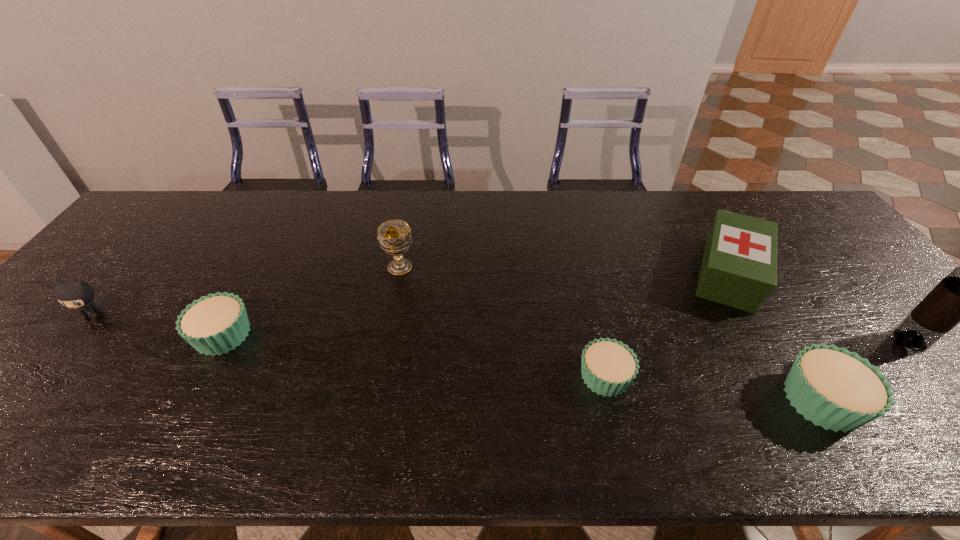
The image size is (960, 540). Find the location of `empty space that is in between the kitten and the tallest object`. empty space that is in between the kitten and the tallest object is located at coordinates (501, 327).

I want to click on unoccupied area between the chalice and the second object from left to right, so click(x=311, y=301).

What are the coordinates of `empty space between the shortest cupcake and the chalice` in the screenshot? It's located at (502, 322).

The image size is (960, 540). Find the location of `free spot between the shortest cupcake and the sixth shortest object`. free spot between the shortest cupcake and the sixth shortest object is located at coordinates tap(502, 322).

Select which object appears as the sixth closest to the first-aid kit. Please provide its 2D coordinates. Your answer should be formatted as a tuple, i.e. [(x, y)], where the tuple contains the x and y coordinates of a point satisfying the conditions above.

[(76, 294)]

At what (x,y) coordinates should I click in order to perform the action: click on object that is the third closest to the shortest cupcake. Please return your answer as a coordinate pair (x, y). Looking at the image, I should click on (394, 236).

The height and width of the screenshot is (540, 960). I want to click on cupcake that is the nearest to the rightmost cupcake, so click(x=608, y=367).

Identify the location of cupcake that is the closest one to the second tallest cupcake. (608, 367).

The image size is (960, 540). I want to click on free space that satisfies the following two spatial constraints: 1. on the back side of the first-aid kit; 2. on the right side of the second object from left to right, so click(x=255, y=274).

At what (x,y) coordinates should I click in order to perform the action: click on vacant space that satisfies the following two spatial constraints: 1. on the front-facing side of the second tallest cupcake; 2. on the right side of the kitten. Please return your answer as a coordinate pair (x, y). Looking at the image, I should click on (76, 335).